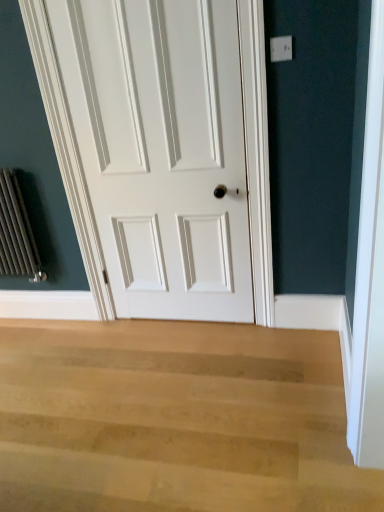
Find the location of a particular element. The height and width of the screenshot is (512, 384). vacant point above light wood floor at lower center (from a real-world perspective) is located at coordinates (134, 392).